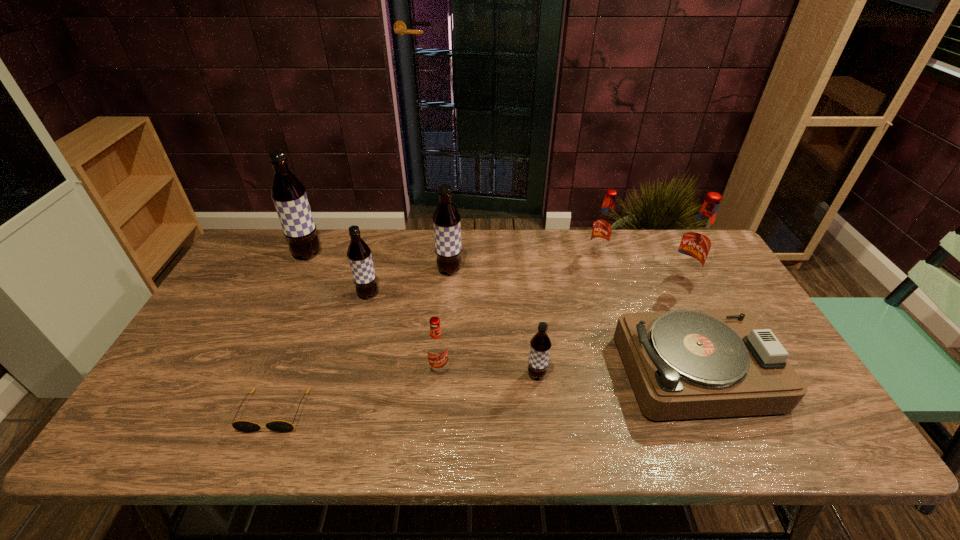
Locate an element on the screen. This screenshot has height=540, width=960. object at the far right corner is located at coordinates (696, 242).

This screenshot has width=960, height=540. Identify the location of object that is at the near right corner. (687, 364).

Locate an element on the screen. The image size is (960, 540). free space at the far edge of the desktop is located at coordinates (538, 246).

In the image, there is a desktop. Where is `vacant space at the near edge`? This screenshot has width=960, height=540. vacant space at the near edge is located at coordinates (600, 418).

Locate an element on the screen. This screenshot has height=540, width=960. blank space at the far right corner is located at coordinates (707, 258).

Where is `blank space at the near right corner of the desktop`? blank space at the near right corner of the desktop is located at coordinates (819, 434).

The height and width of the screenshot is (540, 960). In order to click on blank region between the black sunglasses and the leftmost red root beer in this screenshot , I will do `click(357, 390)`.

Image resolution: width=960 pixels, height=540 pixels. Identify the location of blank region between the black sunglasses and the second farthest red root beer. (479, 345).

The height and width of the screenshot is (540, 960). I want to click on empty location between the second brown root beer from left to right and the leftmost red root beer, so click(x=403, y=332).

Locate an element on the screen. The width and height of the screenshot is (960, 540). free point between the leftmost red root beer and the tallest object is located at coordinates (373, 312).